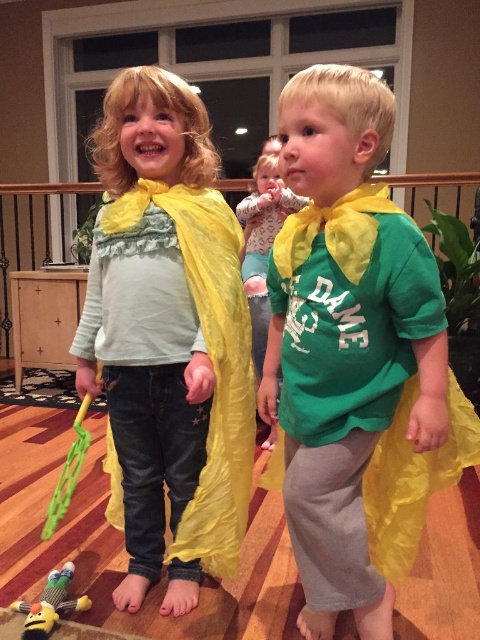
Does matte yellow cape at center appear under plush yellow bee at lower left?

Actually, matte yellow cape at center is above plush yellow bee at lower left.

You are a GUI agent. You are given a task and a screenshot of the screen. Output one action in this format:
    pyautogui.click(x=<x>, y=<y>)
    Task: Click on the matte yellow cape at center
    Image resolution: width=480 pixels, height=640 pixels.
    Given the screenshot: What is the action you would take?
    pyautogui.click(x=168, y=337)

Between point (104, 260) and point (71, 570), which one is positioned behind?

Positioned behind is point (71, 570).

You are a GUI agent. You are given a task and a screenshot of the screen. Output one action in this format:
    pyautogui.click(x=<x>, y=<y>)
    Task: Click on the matte yellow cape at center
    Image resolution: width=480 pixels, height=640 pixels.
    Given the screenshot: What is the action you would take?
    pyautogui.click(x=168, y=337)

Is matte yellow cape at right taller than yellow silky cape at center?

Yes, matte yellow cape at right is taller than yellow silky cape at center.

The image size is (480, 640). I want to click on matte yellow cape at right, so click(x=346, y=337).

Is point (323, 243) farther from camera compared to point (279, 188)?

No, it is in front of (279, 188).

The width and height of the screenshot is (480, 640). In order to click on matte yellow cape at right in this screenshot , I will do tap(346, 337).

Looking at this image, who is more distant from viewer, (252, 257) or (24, 621)?

Point (252, 257)

Does yellow silky cape at center lie behind plush yellow bee at lower left?

Yes.

What are the coordinates of `yellow silky cape at center` in the screenshot? It's located at (264, 220).

The image size is (480, 640). What are the coordinates of `yellow silky cape at center` in the screenshot? It's located at (264, 220).